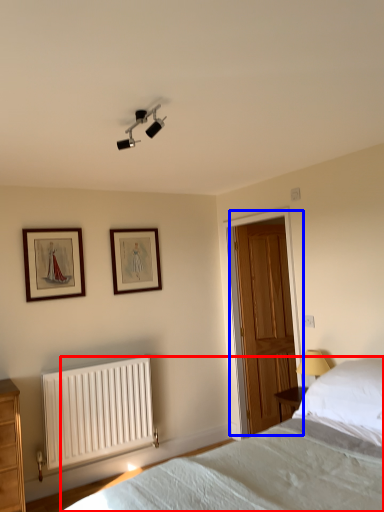
Question: Among these objects, which one is farthest to the camera, bed (highlighted by a red box) or door (highlighted by a blue box)?

Choices:
 (A) bed
 (B) door

Answer: (B)